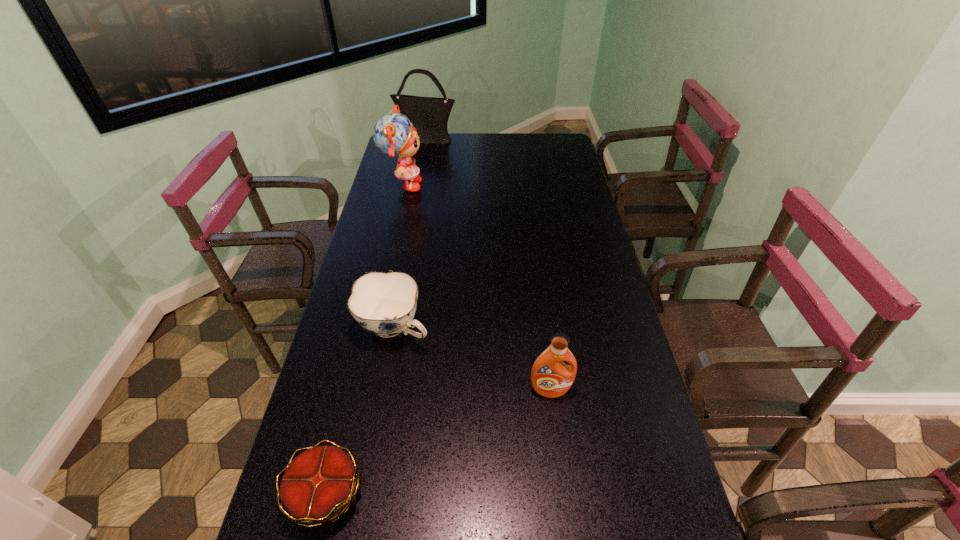
In the image, there is a desktop. Where is `vacant space at the left edge`? vacant space at the left edge is located at coordinates (405, 226).

In the image, there is a desktop. In order to click on free space at the right edge in this screenshot , I will do pyautogui.click(x=609, y=391).

Locate an element on the screen. Image resolution: width=960 pixels, height=540 pixels. vacant space in between the fourth tallest object and the rightmost object is located at coordinates (x=472, y=359).

This screenshot has width=960, height=540. Find the location of `empty space that is in between the third nearest object and the shortest object`. empty space that is in between the third nearest object and the shortest object is located at coordinates (360, 410).

Find the location of a particular element. This screenshot has height=540, width=960. vacant space in between the farthest object and the third nearest object is located at coordinates (410, 233).

Image resolution: width=960 pixels, height=540 pixels. I want to click on empty space between the second shortest object and the fourth nearest object, so click(x=398, y=257).

Where is `vacant space that's between the nearest object and the chinaware`? This screenshot has width=960, height=540. vacant space that's between the nearest object and the chinaware is located at coordinates (360, 410).

Locate an element on the screen. The width and height of the screenshot is (960, 540). empty location between the chinaware and the shoulder bag is located at coordinates (410, 233).

This screenshot has height=540, width=960. I want to click on empty location between the nearest object and the third farthest object, so click(360, 410).

I want to click on blank region between the fourth farthest object and the shoulder bag, so click(489, 264).